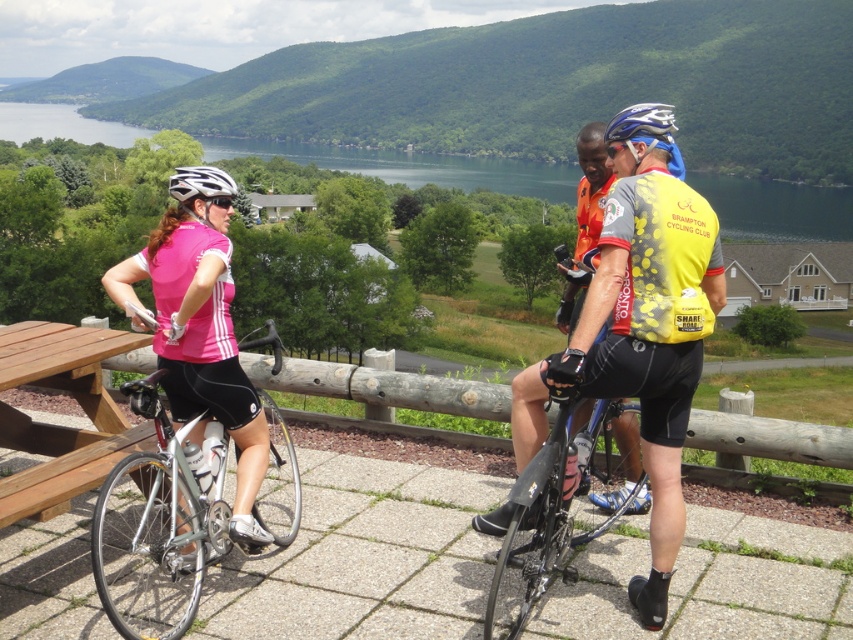
Question: Among these points, which one is nearest to the camera?

Choices:
 (A) (187, 179)
 (B) (177, 586)

Answer: (A)

Question: Is green water at upper center bigger than white matte bicycle helmet at left?

Choices:
 (A) yes
 (B) no

Answer: (A)

Question: Which point appears closest to the camera in this image?

Choices:
 (A) (61, 355)
 (B) (135, 387)
 (C) (196, 172)
 (D) (560, 456)

Answer: (D)

Question: Where is green water at upper center located in relation to white matte bicycle helmet at left in the image?

Choices:
 (A) left
 (B) right

Answer: (A)

Question: In this image, where is shiny black bicycle at center located relative to white matte bicycle helmet at left?

Choices:
 (A) left
 (B) right

Answer: (B)

Question: Which of the following is the farthest from the observer?

Choices:
 (A) (842, 227)
 (B) (161, 525)
 (C) (0, 502)

Answer: (A)